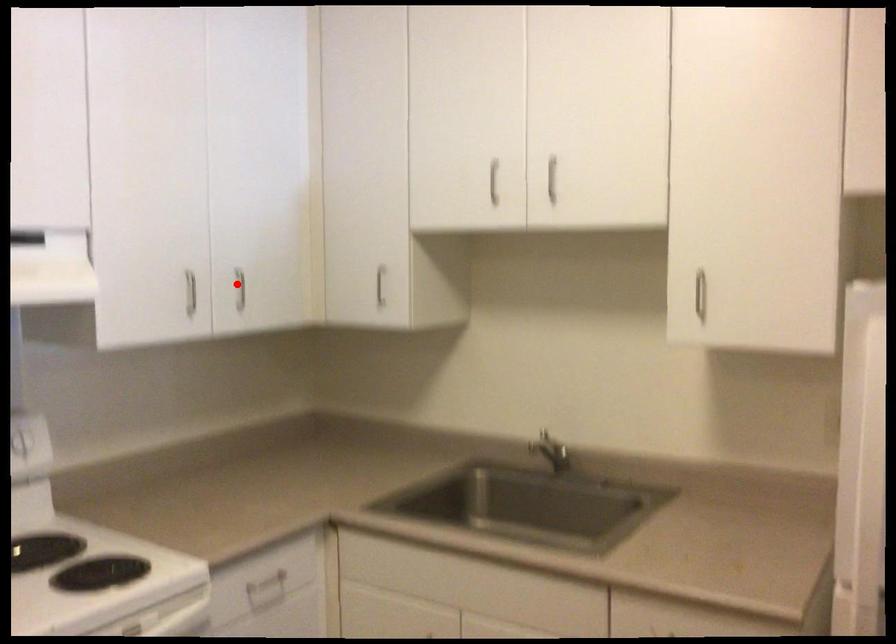
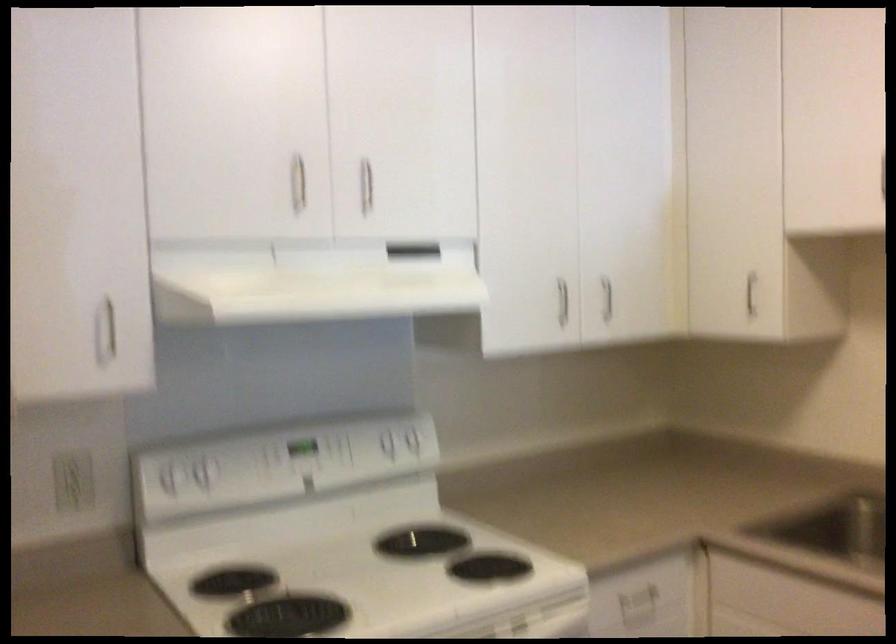
Locate, in the second image, the point that corresponds to the highlighted location in the first image.

(607, 298)